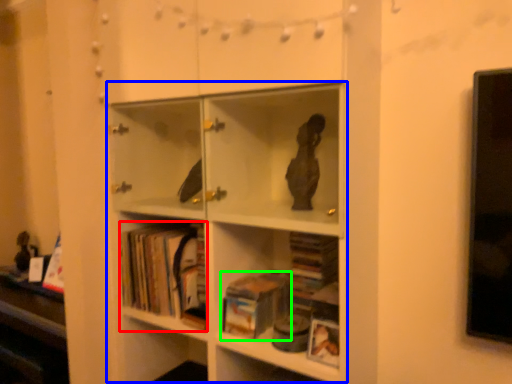
Question: Based on their relative distances, which object is farther from book (highlighted by a red box)? Choose from bookcase (highlighted by a blue box) and book (highlighted by a green box).

Choices:
 (A) bookcase
 (B) book

Answer: (B)